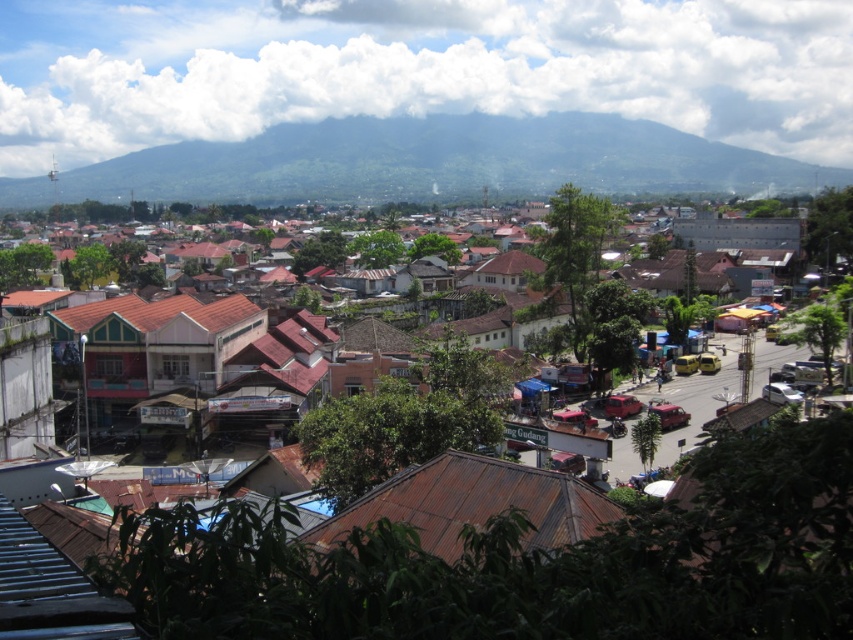
You are a drone operator who needs to capture aerial footage of the town. Given the brown corrugated metal roofs at center and the green forested mountain at upper center, which object would require a wider shot to fully capture in the frame?

The green forested mountain at upper center would require a wider shot because it is larger in size compared to the brown corrugated metal roofs at center.

You are a drone operator trying to capture a clear photo of the green forested mountain at upper center. However, there are brown corrugated metal roofs at center in the way. Can you fly your drone above the roofs to get an unobstructed view of the mountain?

The brown corrugated metal roofs at center are in front of the green forested mountain at upper center, so flying the drone above the roofs would allow you to capture an unobstructed view of the mountain.

You are standing in the town square and want to take a photo of both the point at coordinates point (172, 579) and point (654, 154). Since you want both points to be clearly visible in the photo, which point should you focus on to ensure both are in focus?

You should focus on point (654, 154) because it is further away from the camera than point (172, 579). By focusing on the further point, both points will be within the depth of field and clearly visible.